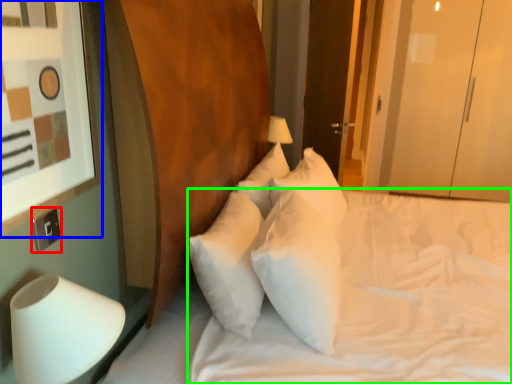
Question: Based on their relative distances, which object is farther from electric outlet (highlighted by a red box)? Choose from picture frame (highlighted by a blue box) and mattress (highlighted by a green box).

Choices:
 (A) picture frame
 (B) mattress

Answer: (B)